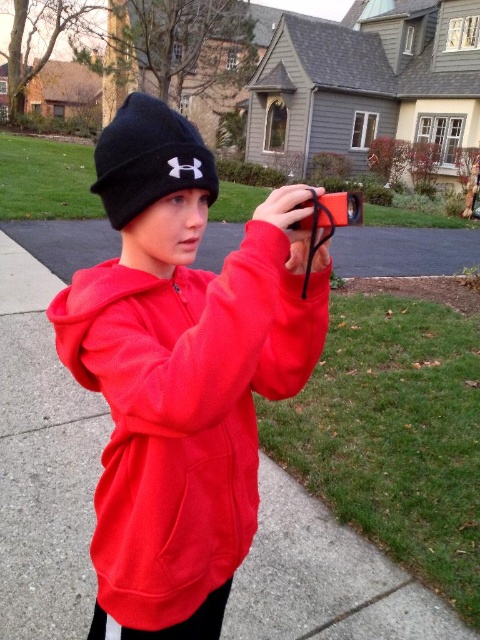
Who is taller, matte red hoodie at center or black knit beanie at upper center?

With more height is black knit beanie at upper center.

Is matte red hoodie at center behind black knit beanie at upper center?

That is False.

Image resolution: width=480 pixels, height=640 pixels. Describe the element at coordinates (184, 413) in the screenshot. I see `matte red hoodie at center` at that location.

The height and width of the screenshot is (640, 480). What are the coordinates of `matte red hoodie at center` in the screenshot? It's located at (184, 413).